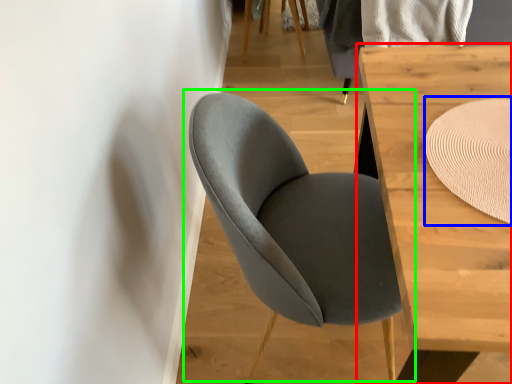
Question: Based on their relative distances, which object is nearer to table (highlighted by a red box)? Choose from mat (highlighted by a blue box) and chair (highlighted by a green box).

Choices:
 (A) mat
 (B) chair

Answer: (A)